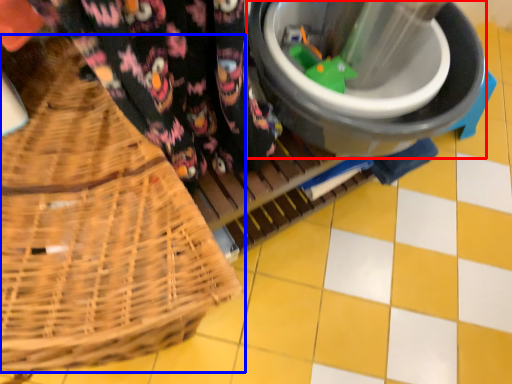
Question: Which of the following is the closest to the observer, appliance (highlighted by a red box) or picnic basket (highlighted by a blue box)?

Choices:
 (A) appliance
 (B) picnic basket

Answer: (B)